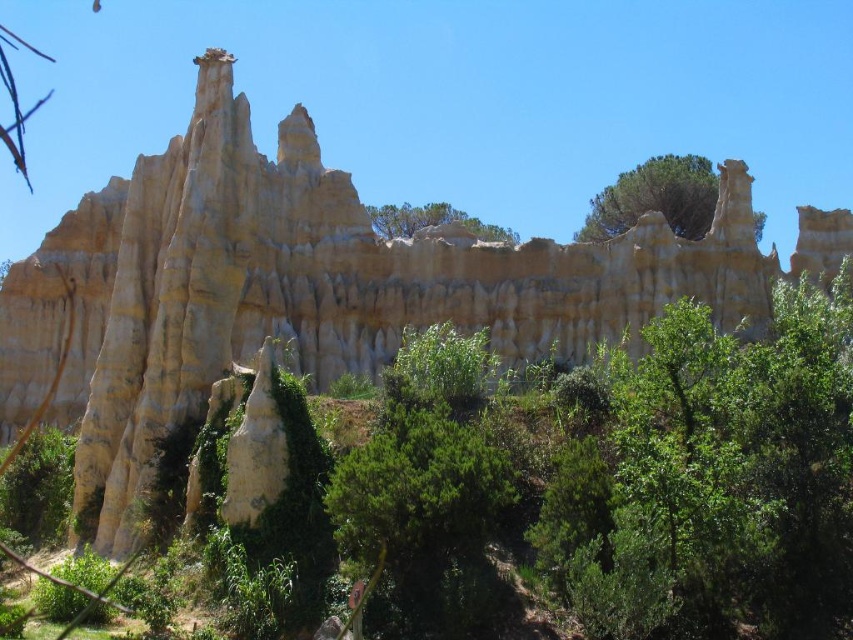
Question: Is green leafy tree at upper center below green leafy tree at center?

Choices:
 (A) yes
 (B) no

Answer: (B)

Question: Can you confirm if green leafy tree at upper center is positioned below green leafy tree at center?

Choices:
 (A) no
 (B) yes

Answer: (A)

Question: Which point is farther to the camera?

Choices:
 (A) (373, 221)
 (B) (670, 216)

Answer: (A)

Question: Can you confirm if green leafy tree at upper center is positioned to the left of green leafy tree at center?

Choices:
 (A) yes
 (B) no

Answer: (B)

Question: Which point is farther to the camera?

Choices:
 (A) (495, 236)
 (B) (704, 163)

Answer: (A)